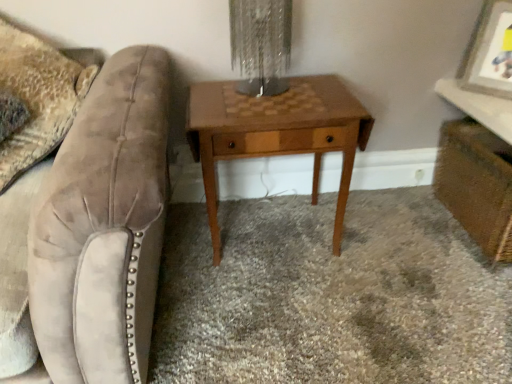
Question: Is wooden picture frame at upper right smaller than velvet swivel chair at left?

Choices:
 (A) yes
 (B) no

Answer: (A)

Question: Is wooden picture frame at upper right not within velvet swivel chair at left?

Choices:
 (A) yes
 (B) no

Answer: (A)

Question: Are wooden picture frame at upper right and velvet swivel chair at left far apart?

Choices:
 (A) no
 (B) yes

Answer: (B)

Question: Does wooden picture frame at upper right turn towards velvet swivel chair at left?

Choices:
 (A) yes
 (B) no

Answer: (B)

Question: From a real-world perspective, does wooden picture frame at upper right stand above velvet swivel chair at left?

Choices:
 (A) no
 (B) yes

Answer: (B)

Question: Considering the relative positions of velvet swivel chair at left and brown wood table at center in the image provided, is velvet swivel chair at left to the left or to the right of brown wood table at center?

Choices:
 (A) left
 (B) right

Answer: (A)

Question: Looking at the image, does velvet swivel chair at left seem bigger or smaller compared to brown wood table at center?

Choices:
 (A) big
 (B) small

Answer: (A)

Question: Considering their positions, is velvet swivel chair at left located in front of or behind brown wood table at center?

Choices:
 (A) behind
 (B) front

Answer: (B)

Question: From the image's perspective, is velvet swivel chair at left positioned above or below brown wood table at center?

Choices:
 (A) below
 (B) above

Answer: (B)

Question: From the image's perspective, is brown wood table at center above or below velvet swivel chair at left?

Choices:
 (A) below
 (B) above

Answer: (A)

Question: From a real-world perspective, is brown wood table at center above or below velvet swivel chair at left?

Choices:
 (A) below
 (B) above

Answer: (A)

Question: Visually, is brown wood table at center positioned to the left or to the right of velvet swivel chair at left?

Choices:
 (A) left
 (B) right

Answer: (B)

Question: Considering the positions of brown wood table at center and velvet swivel chair at left in the image, is brown wood table at center taller or shorter than velvet swivel chair at left?

Choices:
 (A) short
 (B) tall

Answer: (A)

Question: From a real-world perspective, is wooden picture frame at upper right above or below brown wood table at center?

Choices:
 (A) below
 (B) above

Answer: (B)

Question: From the image's perspective, is wooden picture frame at upper right located above or below brown wood table at center?

Choices:
 (A) below
 (B) above

Answer: (B)